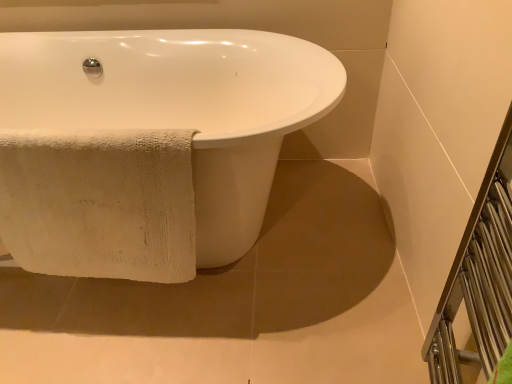
Describe the element at coordinates (100, 204) in the screenshot. I see `beige cotton towel at lower left` at that location.

What do you see at coordinates (236, 304) in the screenshot? The width and height of the screenshot is (512, 384). I see `white towel at lower left` at bounding box center [236, 304].

Locate an element on the screen. The image size is (512, 384). beige cotton towel at lower left is located at coordinates (100, 204).

From the image's perspective, is white towel at lower left under metallic silver balustrade at right?

Incorrect, from the image's perspective, white towel at lower left is higher than metallic silver balustrade at right.

Considering their positions, is white towel at lower left located in front of or behind metallic silver balustrade at right?

In the image, white towel at lower left appears behind metallic silver balustrade at right.

Is white towel at lower left located outside metallic silver balustrade at right?

Absolutely, white towel at lower left is external to metallic silver balustrade at right.

Considering the positions of objects white towel at lower left and metallic silver balustrade at right in the image provided, who is more to the left, white towel at lower left or metallic silver balustrade at right?

white towel at lower left is more to the left.

Is metallic silver balustrade at right smaller than white towel at lower left?

Yes, metallic silver balustrade at right is smaller than white towel at lower left.

Is white towel at lower left completely or partially inside metallic silver balustrade at right?

Actually, white towel at lower left is outside metallic silver balustrade at right.

Is metallic silver balustrade at right oriented towards white towel at lower left?

No, metallic silver balustrade at right does not turn towards white towel at lower left.

Between metallic silver balustrade at right and white towel at lower left, which one has less height?

With less height is white towel at lower left.

The width and height of the screenshot is (512, 384). Find the location of `concrete located behind the beige cotton towel at lower left`. concrete located behind the beige cotton towel at lower left is located at coordinates (236, 304).

From a real-world perspective, which object rests below the other?

white towel at lower left is physically lower.

Does white towel at lower left have a smaller size compared to beige cotton towel at lower left?

No.

Is white towel at lower left at the right side of beige cotton towel at lower left?

Yes.

Considering the sizes of white glossy bathtub at center and white towel at lower left in the image, is white glossy bathtub at center bigger or smaller than white towel at lower left?

Considering their sizes, white glossy bathtub at center takes up more space than white towel at lower left.

This screenshot has width=512, height=384. What are the coordinates of `concrete to the right of white glossy bathtub at center` in the screenshot? It's located at (236, 304).

From the image's perspective, is white glossy bathtub at center located above or below white towel at lower left?

Based on their image positions, white glossy bathtub at center is located above white towel at lower left.

Could you tell me if metallic silver balustrade at right is turned towards beige cotton towel at lower left?

No.

In the scene shown: Are metallic silver balustrade at right and beige cotton towel at lower left far apart?

They are positioned close to each other.

Which object is thinner, metallic silver balustrade at right or beige cotton towel at lower left?

Thinner between the two is beige cotton towel at lower left.

Who is shorter, metallic silver balustrade at right or beige cotton towel at lower left?

Standing shorter between the two is metallic silver balustrade at right.

Does point (245, 299) come farther from viewer compared to point (50, 117)?

No, it is not.

Locate an element on the screen. concrete to the right of white glossy bathtub at center is located at coordinates (236, 304).

Is white towel at lower left at the left side of white glossy bathtub at center?

In fact, white towel at lower left is to the right of white glossy bathtub at center.

What's the angular difference between white towel at lower left and white glossy bathtub at center's facing directions?

89 degrees.

From a real-world perspective, is white glossy bathtub at center over beige cotton towel at lower left?

No, from a real-world perspective, white glossy bathtub at center is not on top of beige cotton towel at lower left.

Is white glossy bathtub at center placed right next to beige cotton towel at lower left?

No, white glossy bathtub at center is not touching beige cotton towel at lower left.

Is white glossy bathtub at center at the left side of beige cotton towel at lower left?

Correct, you'll find white glossy bathtub at center to the left of beige cotton towel at lower left.

Where is `concrete on the left of the metallic silver balustrade at right`? This screenshot has height=384, width=512. concrete on the left of the metallic silver balustrade at right is located at coordinates (236, 304).

I want to click on concrete above the metallic silver balustrade at right (from the image's perspective), so click(x=236, y=304).

Considering their positions, is white glossy bathtub at center positioned further to white towel at lower left than metallic silver balustrade at right?

Among the two, metallic silver balustrade at right is located further to white towel at lower left.

From the image, which object appears to be nearer to white towel at lower left, metallic silver balustrade at right or beige cotton towel at lower left?

beige cotton towel at lower left.

Based on their spatial positions, is metallic silver balustrade at right or white towel at lower left closer to beige cotton towel at lower left?

white towel at lower left is positioned closer to the anchor beige cotton towel at lower left.

When comparing their distances from white towel at lower left, does white glossy bathtub at center or beige cotton towel at lower left seem closer?

beige cotton towel at lower left is positioned closer to the anchor white towel at lower left.

Which object lies nearer to the anchor point white glossy bathtub at center, metallic silver balustrade at right or white towel at lower left?

white towel at lower left lies closer to white glossy bathtub at center than the other object.

Based on the photo, when comparing their distances from beige cotton towel at lower left, does white towel at lower left or white glossy bathtub at center seem further?

white towel at lower left is positioned further to the anchor beige cotton towel at lower left.

Which object lies further to the anchor point beige cotton towel at lower left, white glossy bathtub at center or metallic silver balustrade at right?

The object further to beige cotton towel at lower left is metallic silver balustrade at right.

When comparing their distances from beige cotton towel at lower left, does white glossy bathtub at center or white towel at lower left seem closer?

Among the two, white glossy bathtub at center is located nearer to beige cotton towel at lower left.

Where is `concrete between white glossy bathtub at center and metallic silver balustrade at right`? This screenshot has height=384, width=512. concrete between white glossy bathtub at center and metallic silver balustrade at right is located at coordinates (236, 304).

Where is `towel located between white glossy bathtub at center and metallic silver balustrade at right in the left-right direction`? The width and height of the screenshot is (512, 384). towel located between white glossy bathtub at center and metallic silver balustrade at right in the left-right direction is located at coordinates (100, 204).

You are a GUI agent. You are given a task and a screenshot of the screen. Output one action in this format:
    pyautogui.click(x=<x>, y=<y>)
    Task: Click on the concrete between beige cotton towel at lower left and metallic silver balustrade at right from left to right
    
    Given the screenshot: What is the action you would take?
    pyautogui.click(x=236, y=304)

Find the location of a particular element. The image size is (512, 384). towel between white glossy bathtub at center and white towel at lower left in the vertical direction is located at coordinates (100, 204).